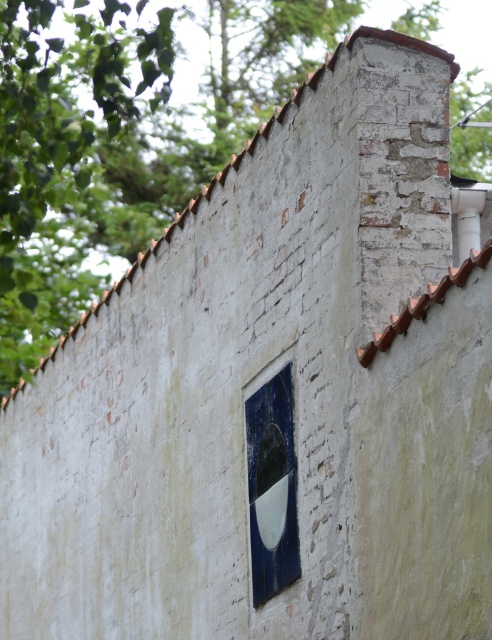
Question: Is green leafy tree at upper left smaller than blue glossy tile at center?

Choices:
 (A) no
 (B) yes

Answer: (A)

Question: Which object appears farthest from the camera in this image?

Choices:
 (A) green leafy tree at upper left
 (B) blue glossy tile at center

Answer: (B)

Question: Among these objects, which one is farthest from the camera?

Choices:
 (A) blue glossy tile at center
 (B) green leafy tree at upper left

Answer: (A)

Question: Is green leafy tree at upper left positioned at the back of blue glossy tile at center?

Choices:
 (A) yes
 (B) no

Answer: (B)

Question: Which point is farther to the camera?

Choices:
 (A) green leafy tree at upper left
 (B) blue glossy tile at center

Answer: (B)

Question: Does green leafy tree at upper left appear on the left side of blue glossy tile at center?

Choices:
 (A) yes
 (B) no

Answer: (A)